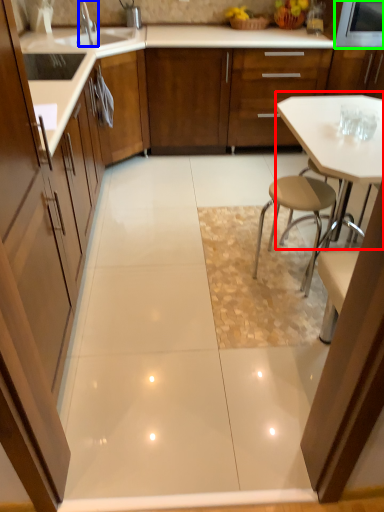
Question: Estimate the real-world distances between objects in this image. Which object is closer to table (highlighted by a red box), tap (highlighted by a blue box) or appliance (highlighted by a green box)?

Choices:
 (A) tap
 (B) appliance

Answer: (B)